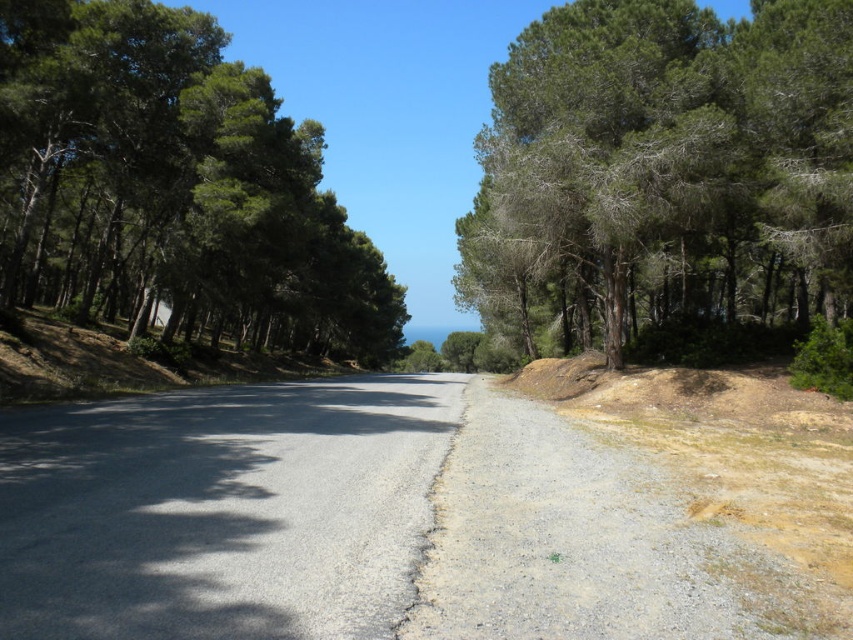
Question: Is asphalt road at center closer to the viewer compared to green needle-like foliage at upper right?

Choices:
 (A) yes
 (B) no

Answer: (A)

Question: Which object is positioned farthest from the green needle-like foliage at upper right?

Choices:
 (A) green leafy trees at left
 (B) asphalt road at center

Answer: (A)

Question: Which of these objects is positioned farthest from the asphalt road at center?

Choices:
 (A) green needle-like foliage at upper right
 (B) green leafy trees at left

Answer: (B)

Question: Does green needle-like foliage at upper right lie behind green leafy trees at left?

Choices:
 (A) no
 (B) yes

Answer: (A)

Question: Can you confirm if asphalt road at center is positioned below green leafy trees at left?

Choices:
 (A) yes
 (B) no

Answer: (A)

Question: Among these objects, which one is farthest from the camera?

Choices:
 (A) green leafy trees at left
 (B) green needle-like foliage at upper right
 (C) asphalt road at center

Answer: (A)